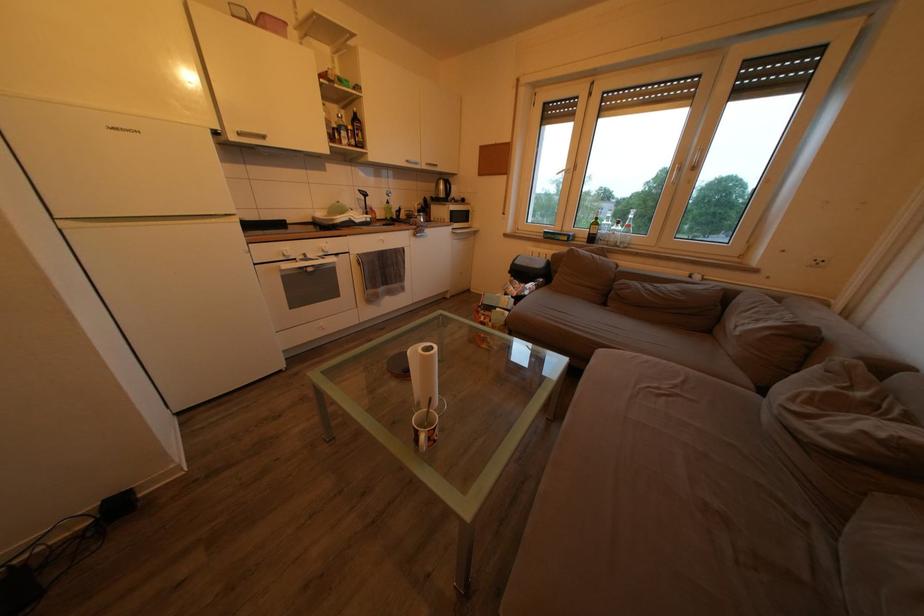
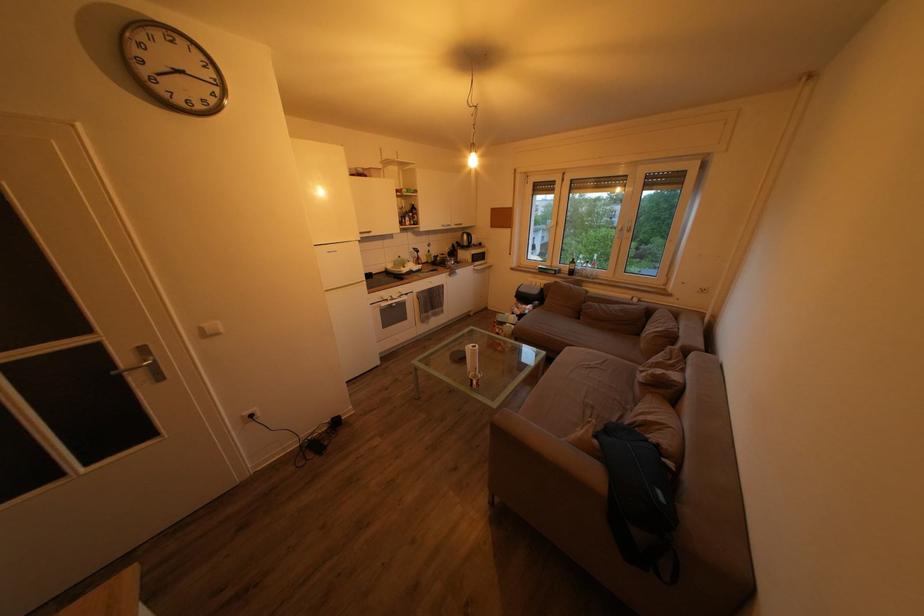
Where in the second image is the point corresponding to (x=736, y=302) from the first image?

(657, 318)